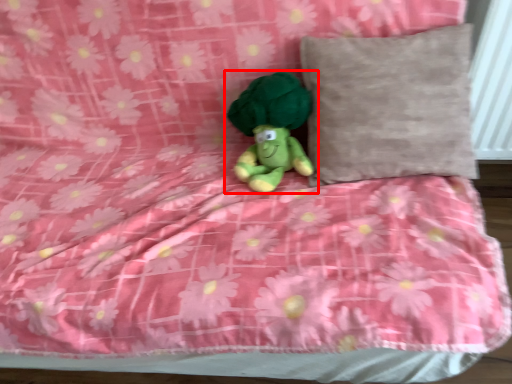
Question: In this image, where is toy (annotated by the red box) located relative to pillow?

Choices:
 (A) left
 (B) right

Answer: (A)